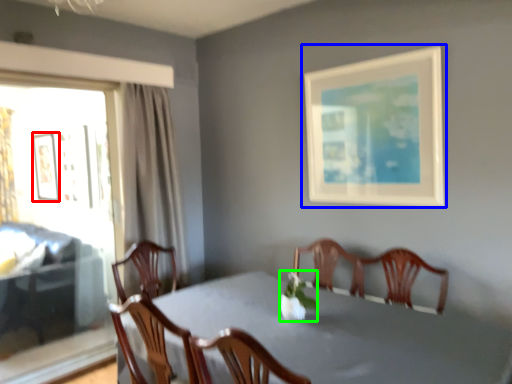
Question: Considering the real-world distances, which object is farthest from picture frame (highlighted by a red box)? picture frame (highlighted by a blue box) or floral arrangement (highlighted by a green box)?

Choices:
 (A) picture frame
 (B) floral arrangement

Answer: (B)